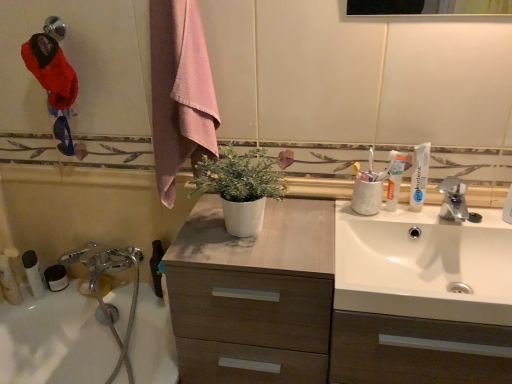
At what (x,y) coordinates should I click in order to perform the action: click on free spot to the left of silver metallic faucet at upper right. Please return your answer as a coordinate pair (x, y). Looking at the image, I should click on (398, 218).